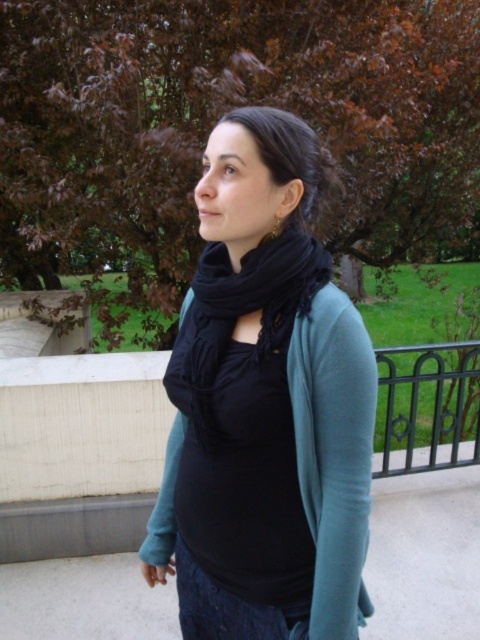
You are a photographer taking a picture of the person wearing the black matte scarf at center. To include the brown leafy tree at upper center in the frame, should you adjust your camera to the left or right?

The brown leafy tree at upper center is to the right of the black matte scarf at center. To include it in the frame while focusing on the scarf, you should adjust your camera to the right.

You are a photographer holding a camera with a 1.2 meter focal length. You want to take a closeup shot of the black matte scarf at center. Is the scarf within the camera range?

The black matte scarf at center is 1.08 meters away from the viewer, which is within the camera range of 1.2 meters. Therefore, the scarf can be captured in a closeup shot.

You are standing in the park and want to walk from the point at coordinates point (448, 140) to the point at coordinates point (173, 384). Since you can only move forward, will you be able to reach the second point without moving backward?

Point (448, 140) is behind point (173, 384), so yes, you can reach the second point by moving forward towards it.